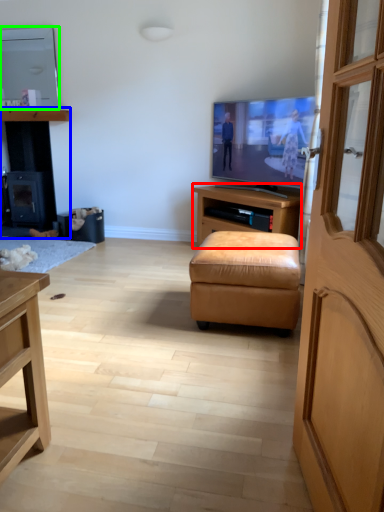
Question: Which object is positioned closest to cabinetry (highlighted by a red box)? Select from dresser (highlighted by a blue box) and television (highlighted by a green box).

Choices:
 (A) dresser
 (B) television

Answer: (B)